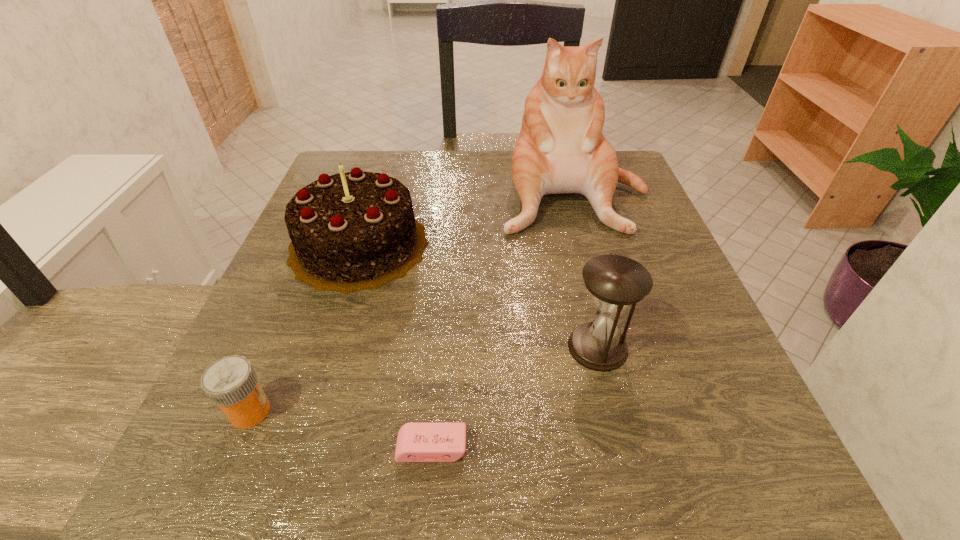
The image size is (960, 540). I want to click on the tallest object, so click(x=561, y=149).

This screenshot has width=960, height=540. Identify the location of birthday cake. (353, 231).

The height and width of the screenshot is (540, 960). I want to click on the third farthest object, so click(x=616, y=282).

Find the location of a particular element. The image size is (960, 540). hourglass is located at coordinates (616, 282).

Where is `medicine`? The width and height of the screenshot is (960, 540). medicine is located at coordinates (231, 382).

Locate an element on the screen. the second nearest object is located at coordinates (231, 382).

Locate an element on the screen. Image resolution: width=960 pixels, height=540 pixels. the shortest object is located at coordinates (417, 442).

The width and height of the screenshot is (960, 540). Identify the location of eraser. (417, 442).

Find the location of a particular element. This screenshot has width=960, height=540. free spot located 0.170m on the face of the tallest object is located at coordinates coord(602,296).

The height and width of the screenshot is (540, 960). Identify the location of vacant space located 0.350m on the front of the fourth shortest object. (277, 500).